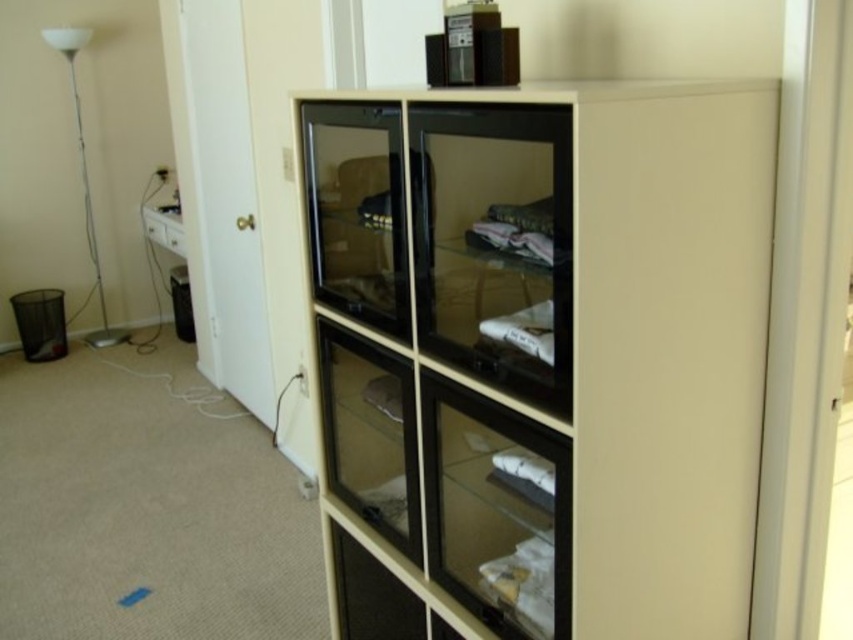
Between beige matte cabinet at center and white glossy floor lamp at left, which one appears on the left side from the viewer's perspective?

white glossy floor lamp at left

Who is taller, beige matte cabinet at center or white glossy floor lamp at left?

Standing taller between the two is white glossy floor lamp at left.

Between point (422, 330) and point (57, 36), which one is positioned in front?

Point (422, 330)

The width and height of the screenshot is (853, 640). I want to click on beige matte cabinet at center, so click(x=538, y=358).

Is point (602, 317) closer to camera compared to point (165, 248)?

Yes, it is.

Is beige matte cabinet at center above white glossy drawer at left?

No, beige matte cabinet at center is not above white glossy drawer at left.

Find the location of a particular element. The image size is (853, 640). beige matte cabinet at center is located at coordinates (538, 358).

Does beige matte cabinet at center lie in front of white fabric at center?

Yes, it is.

Between point (685, 378) and point (553, 348), which one is positioned behind?

The point (685, 378) is behind.

Between point (422, 508) and point (534, 316), which one is positioned behind?

The point (422, 508) is more distant.

Where is `beige matte cabinet at center`? This screenshot has height=640, width=853. beige matte cabinet at center is located at coordinates (538, 358).